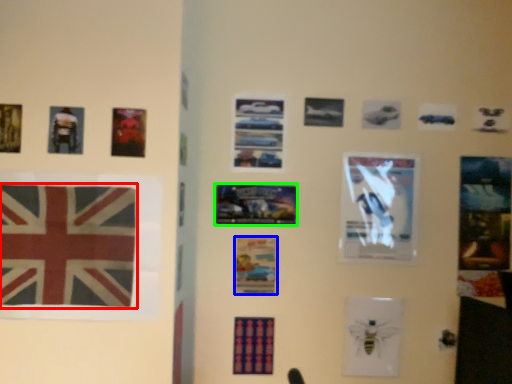
Question: Estimate the real-world distances between objects in this image. Which object is closer to flag (highlighted by a red box), poster (highlighted by a blue box) or poster (highlighted by a green box)?

Choices:
 (A) poster
 (B) poster

Answer: (B)